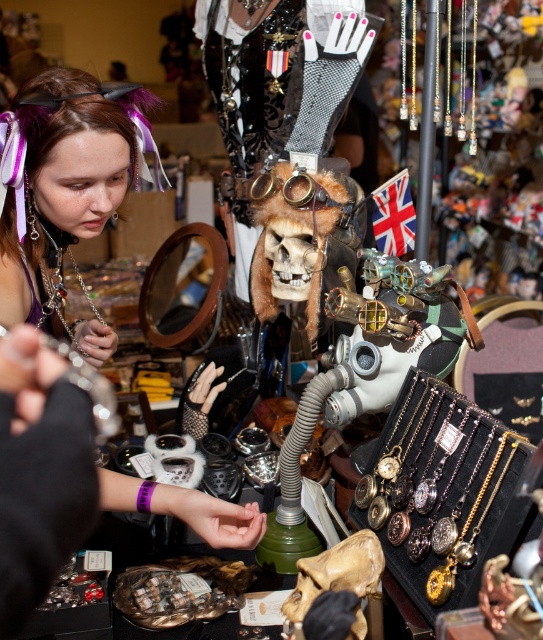
In the scene shown: You are an art curator planning to display the brown matte skull at center and the smooth matte skull at center side by side in a narrow exhibition space. Based on their widths, which skull should be placed first to ensure both fit properly?

The brown matte skull at center might be wider than smooth matte skull at center, so it should be placed first to accommodate its width, ensuring both fit in the narrow space.

You are standing in front of the mannequin and see two points marked in the scene. Which point is closer to you, point (312,173) or point (269,220)?

Point (312,173) is in front of point (269,220), so it is closer to you.